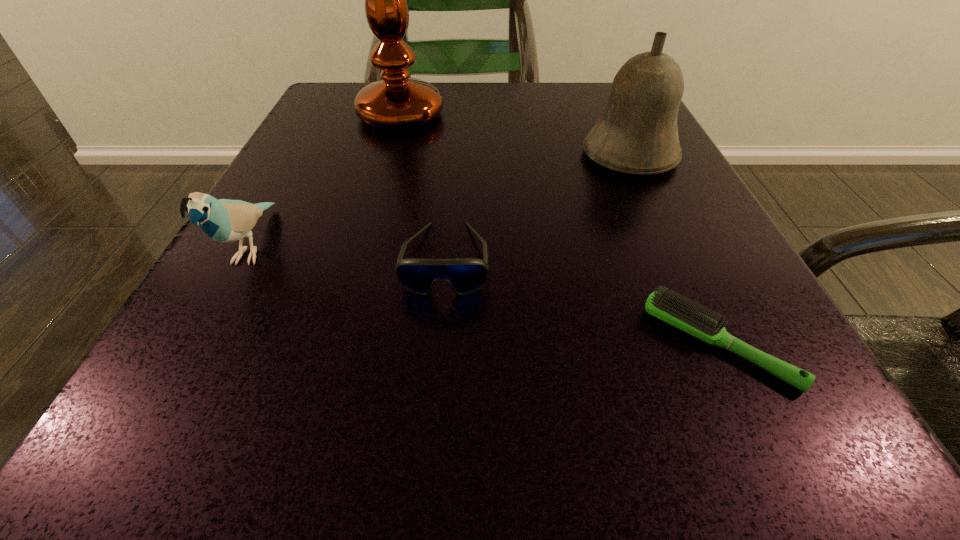
I want to click on table lamp that is at the far edge, so click(x=395, y=103).

Where is `bell positioned at the far edge`? The height and width of the screenshot is (540, 960). bell positioned at the far edge is located at coordinates (637, 133).

You are a GUI agent. You are given a task and a screenshot of the screen. Output one action in this format:
    pyautogui.click(x=<x>, y=<y>)
    Task: Click on the table lamp present at the left edge
    This screenshot has width=960, height=540.
    Given the screenshot: What is the action you would take?
    pyautogui.click(x=395, y=103)

Where is `bird at the left edge`? Image resolution: width=960 pixels, height=540 pixels. bird at the left edge is located at coordinates (223, 220).

Where is `bell that is positioned at the right edge`? The image size is (960, 540). bell that is positioned at the right edge is located at coordinates (637, 133).

Locate an element on the screen. Image resolution: width=960 pixels, height=540 pixels. hairbrush that is at the right edge is located at coordinates (671, 308).

Image resolution: width=960 pixels, height=540 pixels. I want to click on object that is positioned at the far left corner, so click(x=395, y=103).

Where is `object located at the far right corner`? object located at the far right corner is located at coordinates (637, 133).

In the image, there is a desktop. Identify the location of free space at the far edge. (525, 124).

What are the coordinates of `free space at the near edge` in the screenshot? It's located at (388, 492).